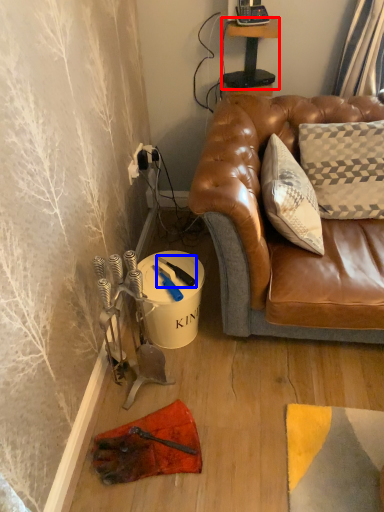
Question: Among these objects, which one is farthest to the camera, table (highlighted by a red box) or tool (highlighted by a blue box)?

Choices:
 (A) table
 (B) tool

Answer: (A)